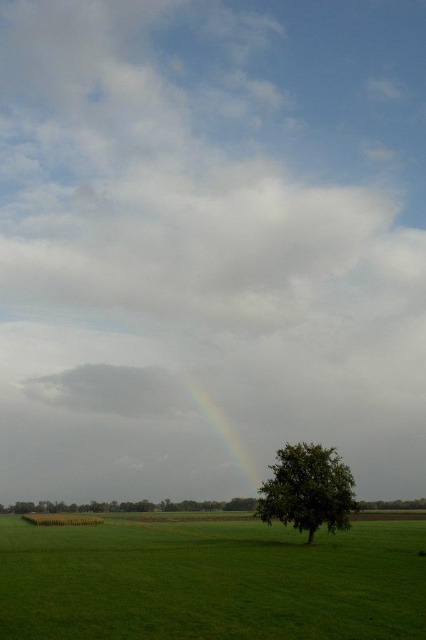
Which is in front, point (331, 531) or point (256, 486)?

Point (331, 531)

How distant is green leafy tree at lower right from rainbow at center?

The distance of green leafy tree at lower right from rainbow at center is 21.49 meters.

Is point (333, 504) farther from camera compared to point (255, 486)?

That is False.

Where is `green leafy tree at lower right`? This screenshot has width=426, height=640. green leafy tree at lower right is located at coordinates (307, 490).

Does point (155, 554) come behind point (291, 456)?

No, (155, 554) is in front of (291, 456).

Between point (351, 589) and point (310, 452), which one is positioned behind?

Positioned behind is point (310, 452).

The width and height of the screenshot is (426, 640). Identify the location of green grassy field at lower left. (210, 580).

Is green grassy field at lower left to the left of rainbow at center from the viewer's perspective?

No, green grassy field at lower left is not to the left of rainbow at center.

Does green grassy field at lower left have a larger size compared to rainbow at center?

Incorrect, green grassy field at lower left is not larger than rainbow at center.

Is point (402, 600) closer to camera compared to point (233, 440)?

Yes, point (402, 600) is in front of point (233, 440).

Locate an element on the screen. The height and width of the screenshot is (640, 426). green grassy field at lower left is located at coordinates (210, 580).